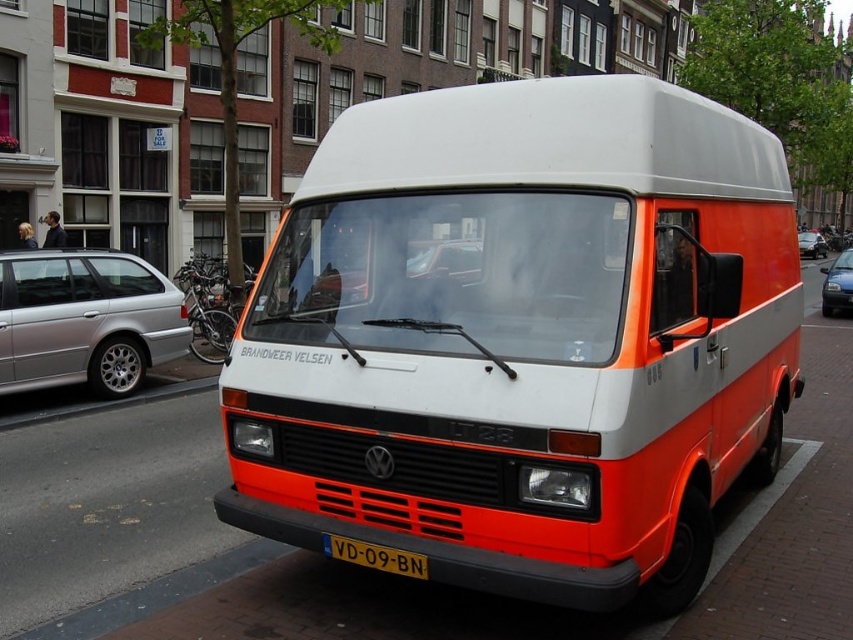
Does point (498, 109) come behind point (369, 552)?

Yes.

Between point (357, 412) and point (349, 557), which one is positioned in front?

Positioned in front is point (357, 412).

I want to click on orange matte van at center, so click(521, 337).

Who is shorter, orange matte van at center or silver metallic car at left?

Standing shorter between the two is silver metallic car at left.

Is orange matte van at center smaller than silver metallic car at left?

Actually, orange matte van at center might be larger than silver metallic car at left.

Does point (338, 392) come closer to viewer compared to point (132, 353)?

Yes, it is.

At what (x,y) coordinates should I click in order to perform the action: click on orange matte van at center. Please return your answer as a coordinate pair (x, y). The image size is (853, 640). Looking at the image, I should click on (521, 337).

Can you confirm if silver metallic car at left is bigger than yellow plastic license plate at center?

Yes, silver metallic car at left is bigger than yellow plastic license plate at center.

Is silver metallic car at left to the left of yellow plastic license plate at center from the viewer's perspective?

Yes, silver metallic car at left is to the left of yellow plastic license plate at center.

Which is in front, point (32, 346) or point (402, 556)?

Point (402, 556) is in front.

In order to click on silver metallic car at left in this screenshot , I will do `click(85, 321)`.